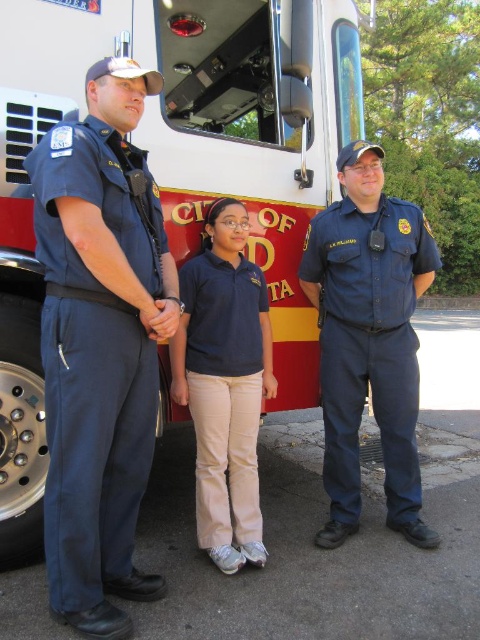
You are standing in a park and see the red and white fire truck at center and the navy blue uniform at left. Which object is positioned to the right of the other?

The red and white fire truck at center is to the right of the navy blue uniform at left.

Consider the image. You are trying to locate the navy blue uniform at left and the blue cotton shirt at center in the image. Based on their positions, which one is positioned to the left side of the other?

The navy blue uniform at left is positioned to the left of the blue cotton shirt at center.